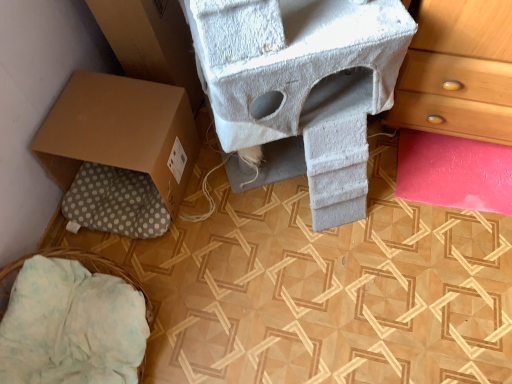
Where is `vacant space to the right of brown cardboard box at lower left`? vacant space to the right of brown cardboard box at lower left is located at coordinates (238, 202).